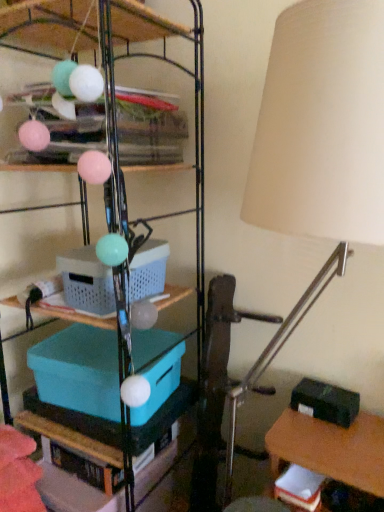
Question: From a real-world perspective, is black matte storage box at lower right, positioned as the first storage box in bottom-to-top order, under metallic wire shelving at upper center, marked as the 1th shelf in a top-to-bottom arrangement?

Choices:
 (A) yes
 (B) no

Answer: (A)

Question: Is black matte storage box at lower right, which is counted as the third storage box, starting from the top, bigger than metallic wire shelving at upper center, marked as the 1th shelf in a top-to-bottom arrangement?

Choices:
 (A) yes
 (B) no

Answer: (B)

Question: From a real-world perspective, is black matte storage box at lower right, marked as the 1th storage box in a right-to-left arrangement, on top of metallic wire shelving at upper center, positioned as the second shelf in bottom-to-top order?

Choices:
 (A) no
 (B) yes

Answer: (A)

Question: Is black matte storage box at lower right, positioned as the first storage box in bottom-to-top order, shorter than metallic wire shelving at upper center, marked as the 1th shelf in a top-to-bottom arrangement?

Choices:
 (A) no
 (B) yes

Answer: (B)

Question: Is black matte storage box at lower right, which is counted as the third storage box, starting from the top, wider than metallic wire shelving at upper center, marked as the 1th shelf in a top-to-bottom arrangement?

Choices:
 (A) no
 (B) yes

Answer: (A)

Question: Which is correct: beige fabric lampshade at right is inside metallic wire shelving at upper center, positioned as the second shelf in bottom-to-top order, or outside of it?

Choices:
 (A) outside
 (B) inside

Answer: (A)

Question: Considering the positions of point (302, 227) and point (44, 28), is point (302, 227) closer or farther from the camera than point (44, 28)?

Choices:
 (A) closer
 (B) farther

Answer: (A)

Question: Relative to metallic wire shelving at upper center, marked as the 1th shelf in a top-to-bottom arrangement, is beige fabric lampshade at right in front or behind?

Choices:
 (A) front
 (B) behind

Answer: (A)

Question: In the image, is beige fabric lampshade at right on the left side or the right side of metallic wire shelving at upper center, marked as the 1th shelf in a top-to-bottom arrangement?

Choices:
 (A) left
 (B) right

Answer: (B)

Question: Is metallic wire shelving at upper center, marked as the 1th shelf in a top-to-bottom arrangement, wider or thinner than plastic basket at center, arranged as the 3th storage box when ordered from the bottom?

Choices:
 (A) thin
 (B) wide

Answer: (B)

Question: From a real-world perspective, is metallic wire shelving at upper center, marked as the 1th shelf in a top-to-bottom arrangement, above or below plastic basket at center, acting as the first storage box starting from the top?

Choices:
 (A) below
 (B) above

Answer: (B)

Question: Considering the positions of point (51, 7) and point (137, 287), is point (51, 7) closer or farther from the camera than point (137, 287)?

Choices:
 (A) farther
 (B) closer

Answer: (B)

Question: From the image's perspective, is metallic wire shelving at upper center, marked as the 1th shelf in a top-to-bottom arrangement, located above or below plastic basket at center, placed as the 2th storage box when sorted from right to left?

Choices:
 (A) below
 (B) above

Answer: (B)

Question: In terms of size, does teal plastic storage box at center-left, which ranks as the second storage box in bottom-to-top order, appear bigger or smaller than teal plastic storage bin at center, which is counted as the 2th shelf, starting from the top?

Choices:
 (A) small
 (B) big

Answer: (A)

Question: Is point (152, 410) closer or farther from the camera than point (134, 503)?

Choices:
 (A) farther
 (B) closer

Answer: (B)